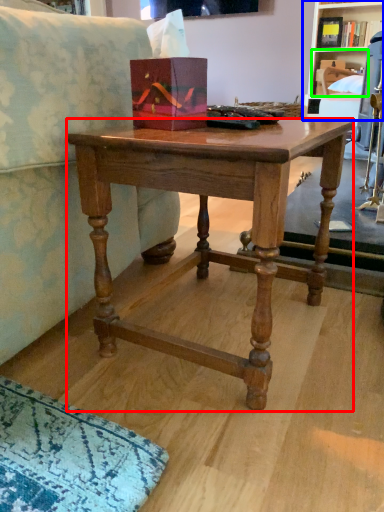
Question: Which object is positioned farthest from desk (highlighted by a red box)? Select from shelf (highlighted by a blue box) and shelf (highlighted by a green box).

Choices:
 (A) shelf
 (B) shelf

Answer: (B)